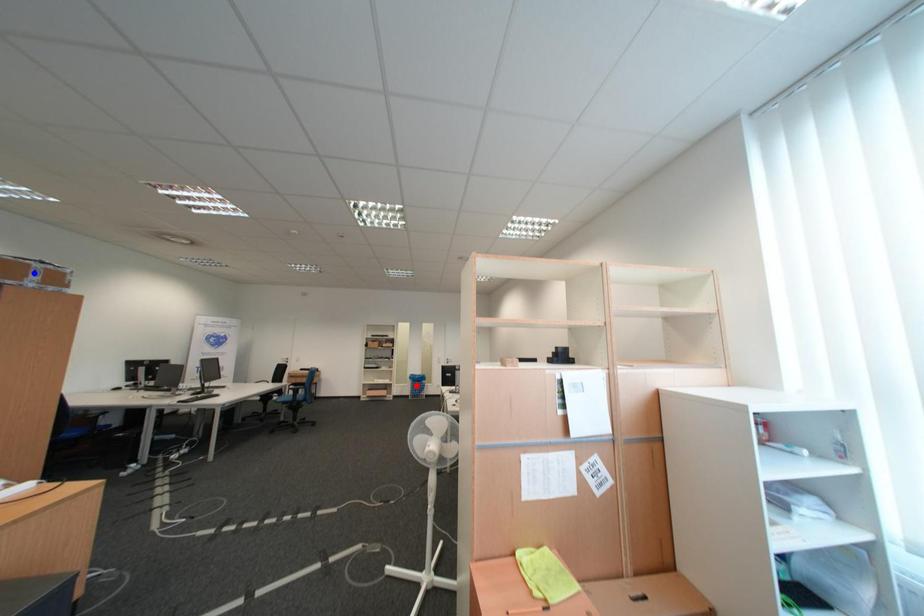
Question: Which of the two points in the image is closer to the camera?

Choices:
 (A) Blue point is closer.
 (B) Red point is closer.

Answer: (A)